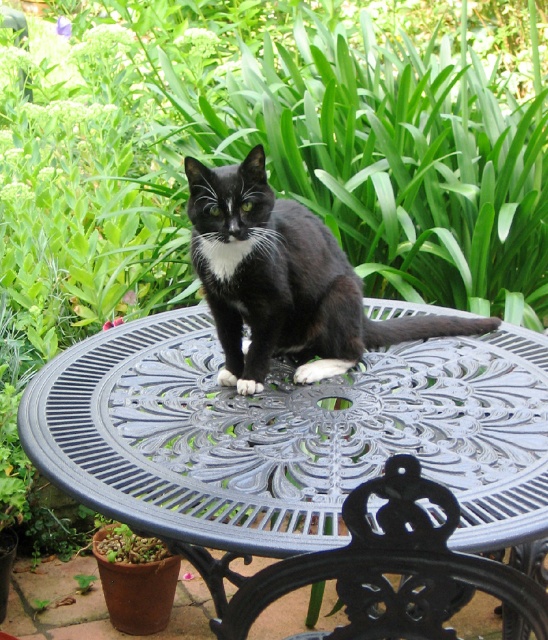
You are a photographer setting up a shoot in a garden. You have a matte black cat at center and a black cast iron chair at center in your frame. Which object will appear bigger in your photo?

The matte black cat at center appears bigger in the photo because it has a larger size compared to the black cast iron chair at center.

You are a photographer setting up a shot of the matte black cat at center and the metallic gray table at center. Since you want to focus on the cat, which object should you ensure is not too large in the frame to avoid distraction?

The metallic gray table at center is larger than the matte black cat at center, so to focus on the cat, you should ensure the metallic gray table at center is not too large in the frame to avoid distraction.

You are a photographer aiming to capture the perfect shot of the matte black cat at center. The camera you are using has a focus point at coordinates point (284,282). Will this focus point land on the matte black cat at center?

Yes, the point (284,282) corresponds to the matte black cat at center, so the focus point will land on the matte black cat at center.